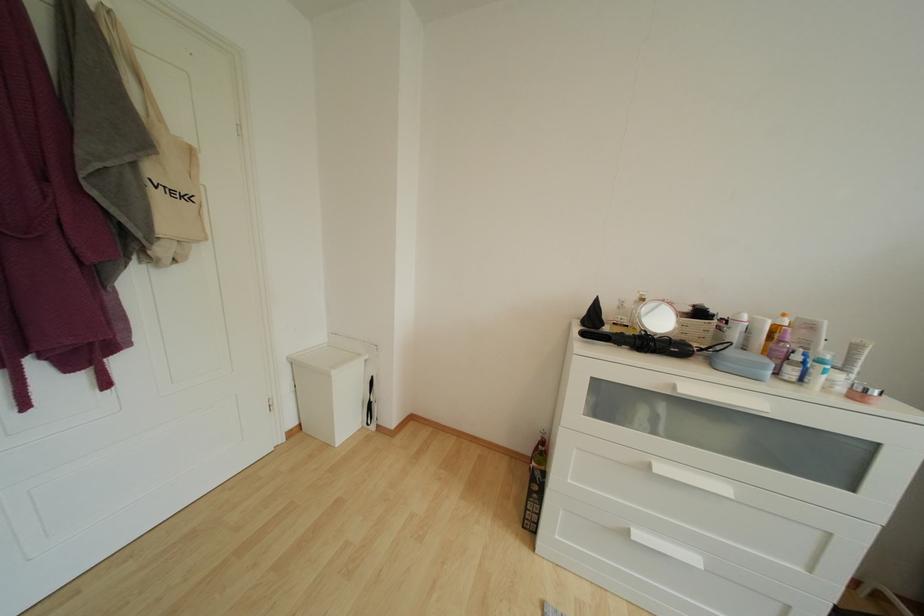
Where would you push the orange bottle pump? Please return your answer as a coordinate pair (x, y).

(535, 485)